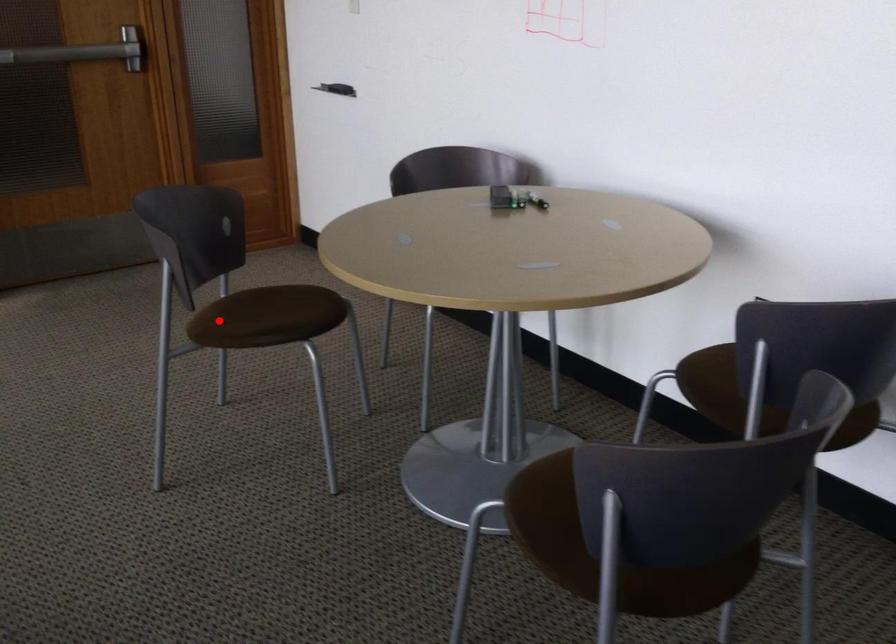
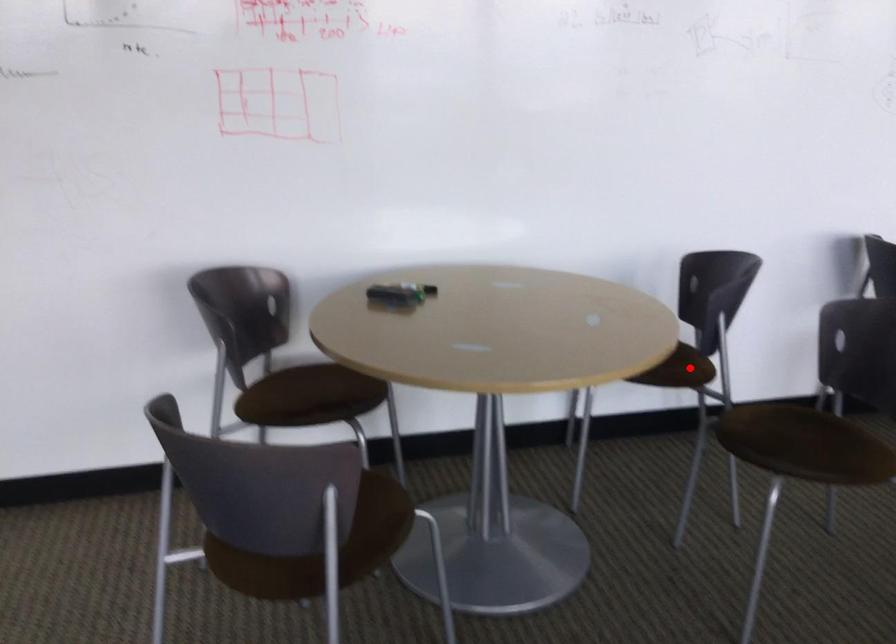
I am providing you with two images of the same scene from different viewpoints. A red point is marked on the first image and another point is marked on the second image. Do the highlighted points in image1 and image2 indicate the same real-world spot?

No